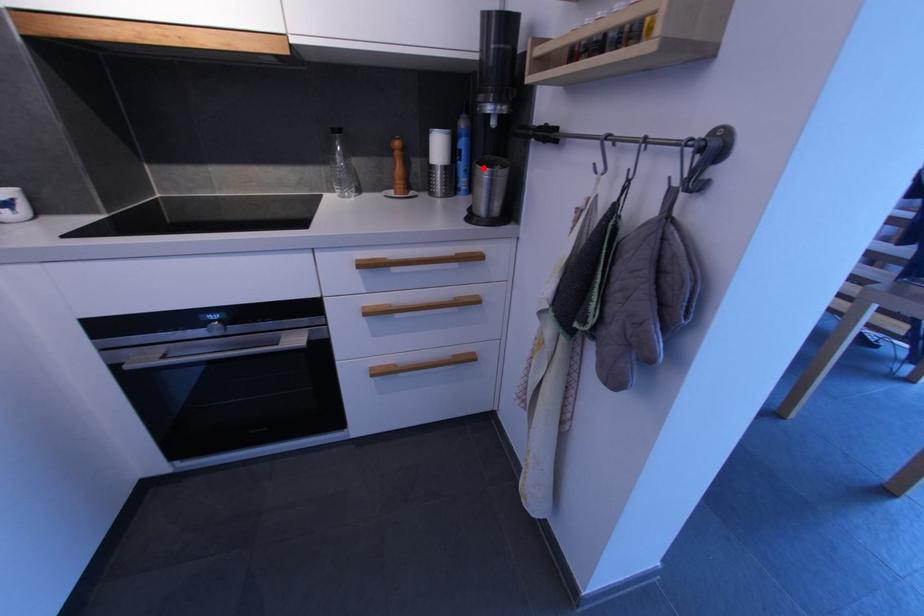
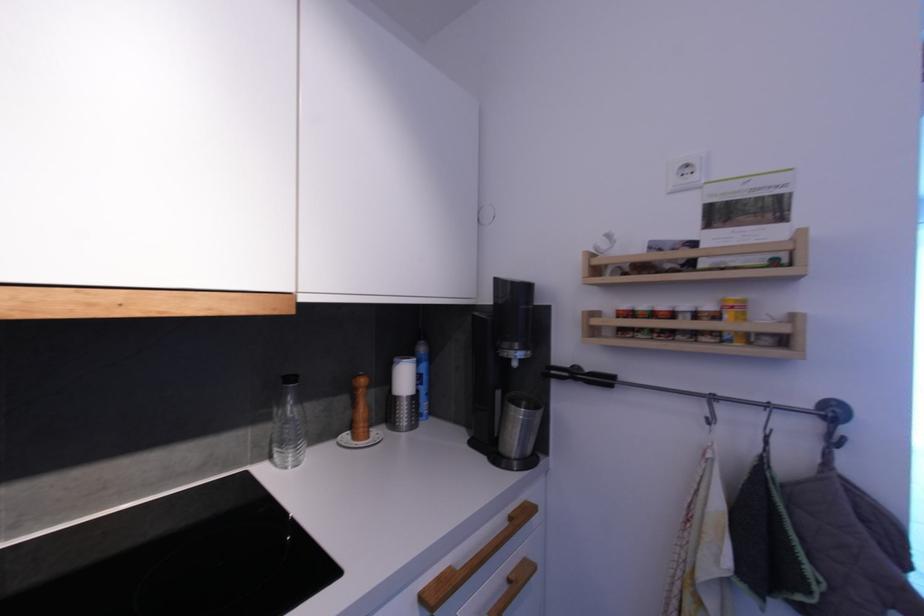
Where in the second image is the point corresponding to the highlighted location from the first image?

(517, 408)